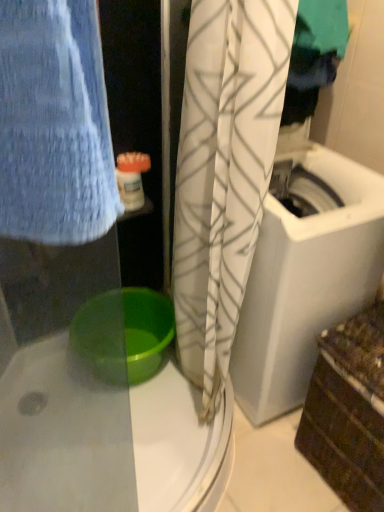
Question: Can you confirm if white textured curtain at center is taller than green plastic basin at lower center?

Choices:
 (A) yes
 (B) no

Answer: (A)

Question: Is white textured curtain at center further to camera compared to green plastic basin at lower center?

Choices:
 (A) yes
 (B) no

Answer: (B)

Question: Does white textured curtain at center have a lesser width compared to green plastic basin at lower center?

Choices:
 (A) no
 (B) yes

Answer: (B)

Question: Is white textured curtain at center in contact with green plastic basin at lower center?

Choices:
 (A) no
 (B) yes

Answer: (A)

Question: Is white textured curtain at center to the left of green plastic basin at lower center from the viewer's perspective?

Choices:
 (A) yes
 (B) no

Answer: (B)

Question: Is green plastic basin at lower center situated inside white textured curtain at center or outside?

Choices:
 (A) inside
 (B) outside

Answer: (B)

Question: In terms of size, does green plastic basin at lower center appear bigger or smaller than white textured curtain at center?

Choices:
 (A) big
 (B) small

Answer: (B)

Question: In terms of width, does green plastic basin at lower center look wider or thinner when compared to white textured curtain at center?

Choices:
 (A) wide
 (B) thin

Answer: (A)

Question: Based on their positions, is green plastic basin at lower center located to the left or right of white textured curtain at center?

Choices:
 (A) right
 (B) left

Answer: (B)

Question: Is white plastic container at upper center wider or thinner than white textured curtain at center?

Choices:
 (A) wide
 (B) thin

Answer: (B)

Question: Is white plastic container at upper center in front of or behind white textured curtain at center in the image?

Choices:
 (A) behind
 (B) front

Answer: (A)

Question: From the image's perspective, is white plastic container at upper center positioned above or below white textured curtain at center?

Choices:
 (A) below
 (B) above

Answer: (B)

Question: Does point (115, 168) appear closer or farther from the camera than point (192, 256)?

Choices:
 (A) farther
 (B) closer

Answer: (A)

Question: Would you say white textured curtain at center is to the left or to the right of green plastic basin at lower center in the picture?

Choices:
 (A) right
 (B) left

Answer: (A)

Question: Is white textured curtain at center wider or thinner than green plastic basin at lower center?

Choices:
 (A) wide
 (B) thin

Answer: (B)